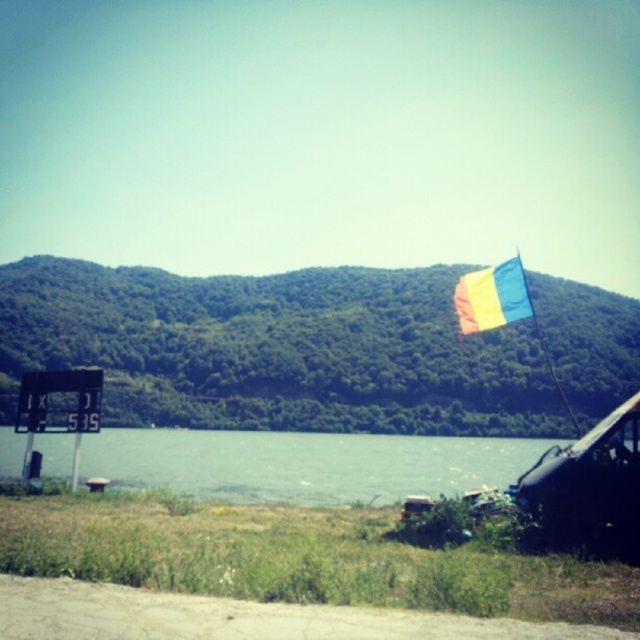
Can you confirm if clear water at center is positioned below multicolored fabric flag at upper right?

Yes, clear water at center is below multicolored fabric flag at upper right.

Is the position of clear water at center more distant than that of multicolored fabric flag at upper right?

Yes, clear water at center is behind multicolored fabric flag at upper right.

Where is `clear water at center`? This screenshot has width=640, height=640. clear water at center is located at coordinates (304, 464).